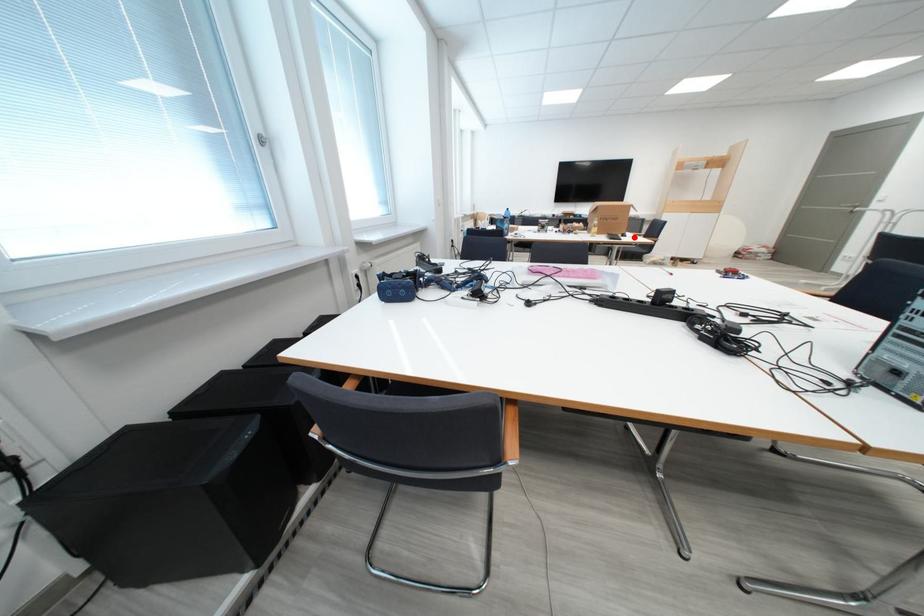
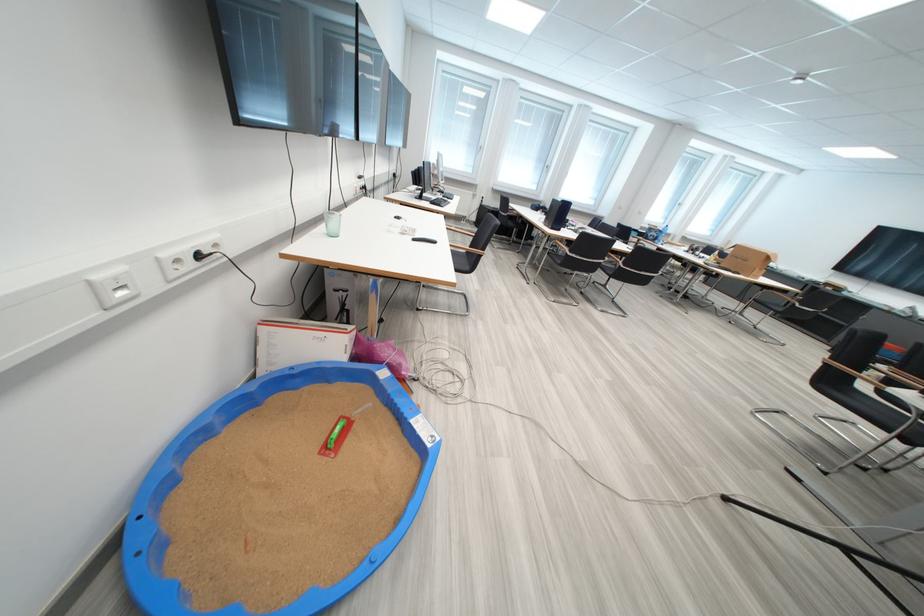
Where in the second image is the point corresponding to the highlighted location from the first image?

(746, 275)